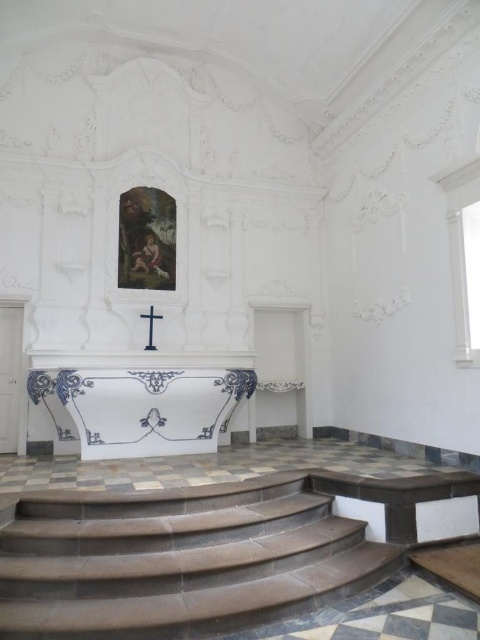
You are standing in the chapel and want to place a bouquet of flowers on the blue and white porcelain altar at center. If you can reach up to 2 meters, can you place the flowers without needing a ladder?

The blue and white porcelain altar at center is 6.48 meters away from viewer, which is farther than the 2 meters you can reach. Therefore, you will need a ladder to place the bouquet.

You are standing at the entrance of the chapel and notice a point marked at coordinates (179,560). Based on the scene description, can you determine what this point is located on?

The point is located on the brown stone stairs at lower center.

You are standing in the chapel and want to walk up the brown stone stairs at lower center. To do so, you first need to pass by the black wood cross at center. In which direction should you move relative to the cross to reach the stairs?

The brown stone stairs at lower center are to the right of the black wood cross at center, so you should move to the right of the cross to reach the stairs.